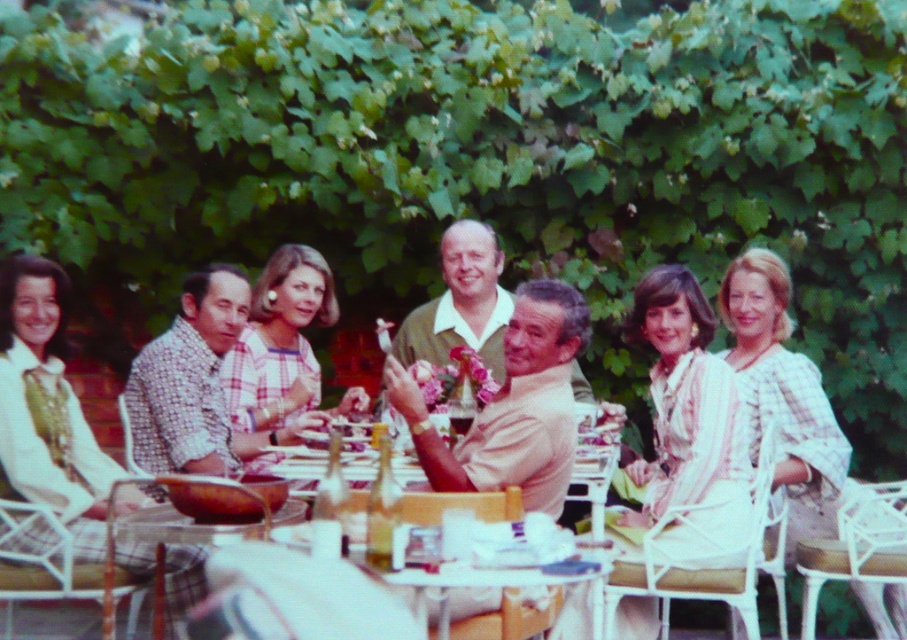
You are a photographer positioned to take a photo of the clear glass table at center and the light beige fabric shirt at center. Which object is positioned closer to your camera lens?

The clear glass table at center is closer to the viewer than the light beige fabric shirt at center, so the clear glass table at center would be closer to the camera lens.

Looking at this image, you are a photographer at the event and need to position yourself to capture a shot where both the clear glass table at center and the light beige fabric shirt at center are visible. Based on their positions, which object should be closer to the camera to ensure both are in frame?

The clear glass table at center is located below the light beige fabric shirt at center. To ensure both are visible in the frame, the photographer should position themselves so that the light beige fabric shirt at center is closer to the camera, as it is above the table, allowing the table to be seen below it.